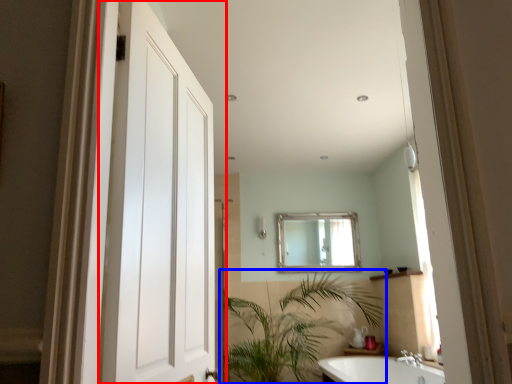
Question: Which of the following is the closest to the observer, door (highlighted by a red box) or houseplant (highlighted by a blue box)?

Choices:
 (A) door
 (B) houseplant

Answer: (A)